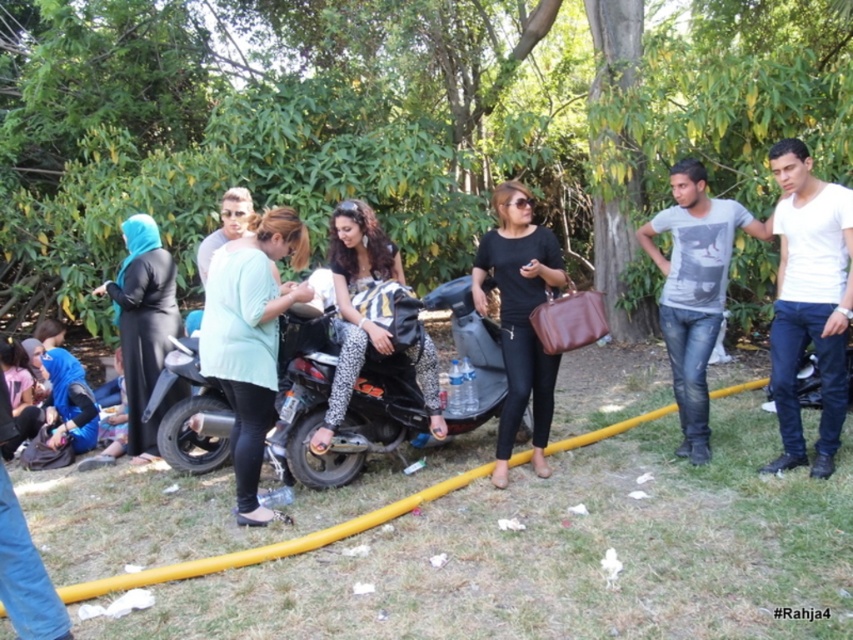
In the scene shown: You are a delivery person who needs to place a 18 inch long package between the black matte motorcycle at center and the black matte shirt at center. Can you fit it there?

The black matte motorcycle at center and black matte shirt at center are 20.34 inches apart from each other. Since the package is 18 inches long, it can fit between them with some space remaining.